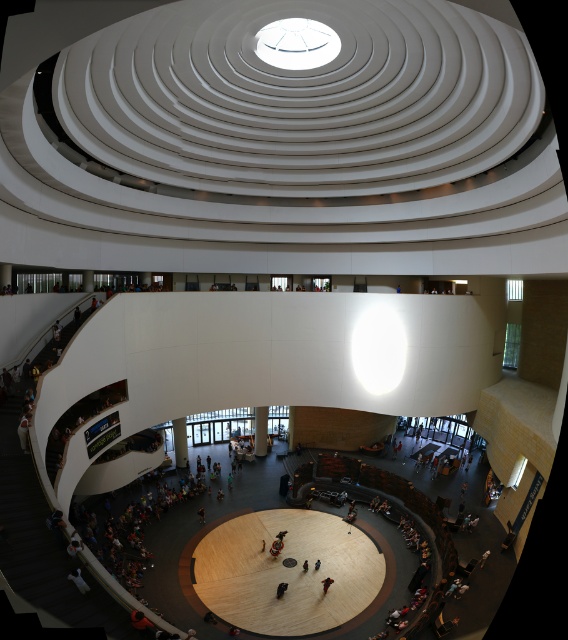
Question: Can you confirm if white glossy pillar at center is bigger than dark blue fabric person at center?

Choices:
 (A) no
 (B) yes

Answer: (B)

Question: Considering the relative positions of white smooth pillar at center and dark brown leather jacket at center in the image provided, where is white smooth pillar at center located with respect to dark brown leather jacket at center?

Choices:
 (A) above
 (B) below

Answer: (A)

Question: Which object appears farthest from the camera in this image?

Choices:
 (A) dark blue jeans at center
 (B) dark blue fabric person at center
 (C) white glossy pillar at center

Answer: (C)

Question: Which object is closer to the camera taking this photo?

Choices:
 (A) dark blue fabric person at center
 (B) white smooth pillar at center
 (C) dark blue jeans at center
 (D) dark brown leather jacket at center

Answer: (D)

Question: Among these points, which one is farthest from the camera?

Choices:
 (A) (254, 440)
 (B) (319, 560)
 (C) (186, 456)

Answer: (A)

Question: Can you confirm if white smooth pillar at center is positioned below dark blue fabric person at center?

Choices:
 (A) no
 (B) yes

Answer: (A)